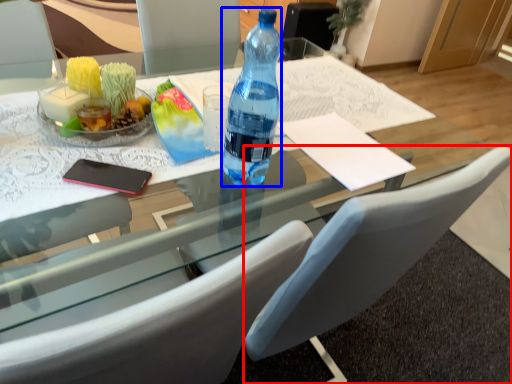
Question: Which point is further to the camera, chair (highlighted by a red box) or bottle (highlighted by a blue box)?

Choices:
 (A) chair
 (B) bottle

Answer: (B)